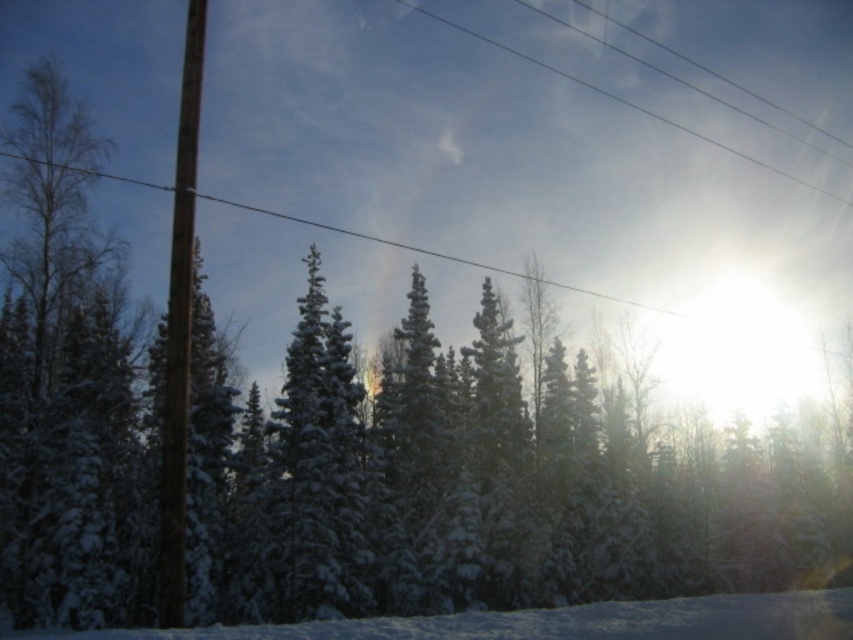
Image resolution: width=853 pixels, height=640 pixels. In order to click on white snow at lower center in this screenshot , I will do `click(561, 621)`.

Does white snow at lower center lie behind clear plastic power lines at upper center?

No, white snow at lower center is closer to the viewer.

The width and height of the screenshot is (853, 640). Describe the element at coordinates (561, 621) in the screenshot. I see `white snow at lower center` at that location.

I want to click on white snow at lower center, so click(x=561, y=621).